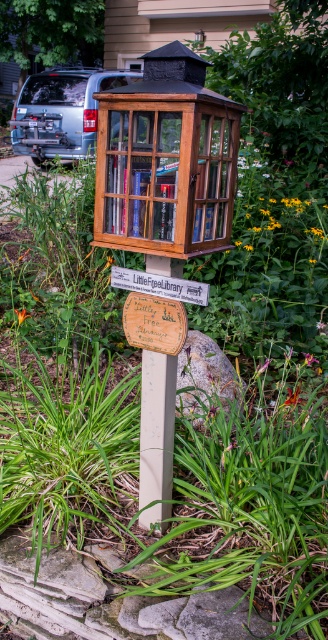
Question: Can you confirm if orange matte flower at center is positioned to the left of yellow textured flower at center?

Choices:
 (A) yes
 (B) no

Answer: (A)

Question: Which object is farther from the camera taking this photo?

Choices:
 (A) yellow matte flower at center
 (B) yellow textured flower at center

Answer: (B)

Question: Which point is closer to the camera?

Choices:
 (A) (290, 401)
 (B) (157, 275)

Answer: (B)

Question: Which point is closer to the camera?

Choices:
 (A) white wood sign at center
 (B) yellow matte flower at center
 (C) purple matte flower at center
 (D) wooden birdhouse at center

Answer: (D)

Question: In this image, where is wooden birdhouse at center located relative to white wood sign at center?

Choices:
 (A) right
 (B) left

Answer: (A)

Question: Can you confirm if wooden birdhouse at center is positioned above orange matte flower at center?

Choices:
 (A) no
 (B) yes

Answer: (B)